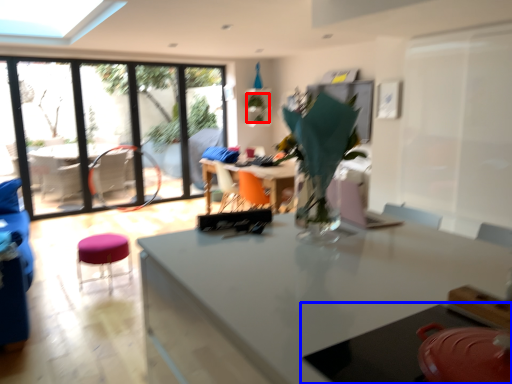
Question: Which object is further to the camera taking this photo, plant (highlighted by a red box) or table (highlighted by a blue box)?

Choices:
 (A) plant
 (B) table

Answer: (A)